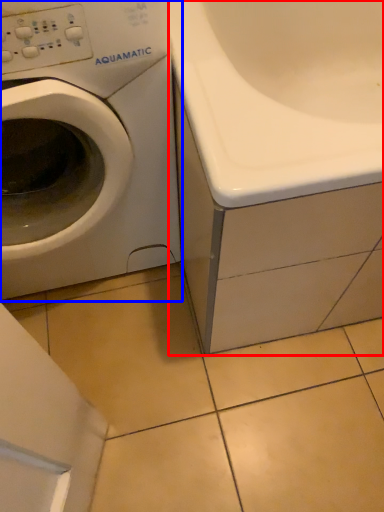
Question: Which object appears closest to the camera in this image, bath (highlighted by a red box) or washing machine (highlighted by a blue box)?

Choices:
 (A) bath
 (B) washing machine

Answer: (B)